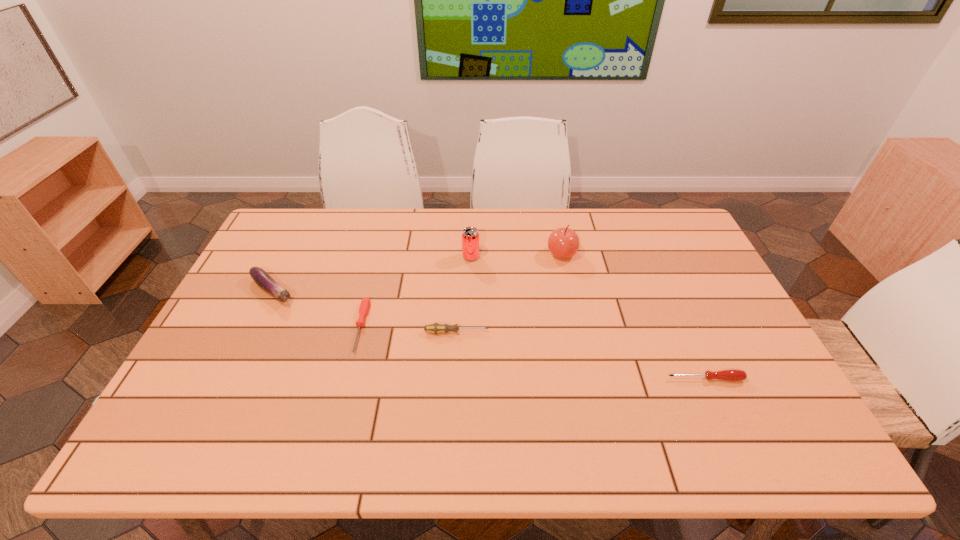
Where is `vacant area between the rightmost object and the fifth object from left to right`? Image resolution: width=960 pixels, height=540 pixels. vacant area between the rightmost object and the fifth object from left to right is located at coordinates (634, 316).

Where is `the second closest object to the nearest object`? The width and height of the screenshot is (960, 540). the second closest object to the nearest object is located at coordinates (435, 328).

I want to click on object that stands as the fourth closest to the leftmost object, so click(x=563, y=243).

Identify the location of screwdriver that is the closest to the soda can. The width and height of the screenshot is (960, 540). (435, 328).

Select which screwdriver appears as the second closest to the leftmost object. Please provide its 2D coordinates. Your answer should be formatted as a tuple, i.e. [(x, y)], where the tuple contains the x and y coordinates of a point satisfying the conditions above.

[(435, 328)]

You are a GUI agent. You are given a task and a screenshot of the screen. Output one action in this format:
    pyautogui.click(x=<x>, y=<y>)
    Task: Click on the free space that satisfies the following two spatial constraints: 1. on the back side of the fifth object from left to right; 2. on the right side of the soda can
    
    Given the screenshot: What is the action you would take?
    pyautogui.click(x=471, y=254)

At what (x,y) coordinates should I click in order to perform the action: click on vacant space that satisfies the following two spatial constraints: 1. on the back side of the soda can; 2. on the left side of the eggplant. Please return your answer as a coordinate pair (x, y). Looking at the image, I should click on (289, 257).

I want to click on free space in the image that satisfies the following two spatial constraints: 1. on the front side of the nearest object; 2. on the right side of the eggplant, so click(x=229, y=379).

You are a GUI agent. You are given a task and a screenshot of the screen. Output one action in this format:
    pyautogui.click(x=<x>, y=<y>)
    Task: Click on the free spot that satisfies the following two spatial constraints: 1. at the tip of the rightmost screwdriver; 2. on the left side of the second screwdriver from right to left
    The width and height of the screenshot is (960, 540).
    Given the screenshot: What is the action you would take?
    pyautogui.click(x=454, y=379)

What are the coordinates of `vacant point that satisfies the following two spatial constraints: 1. at the tip of the rightmost screwdriver; 2. on the right side of the second screwdriver from left to right` in the screenshot? It's located at (454, 379).